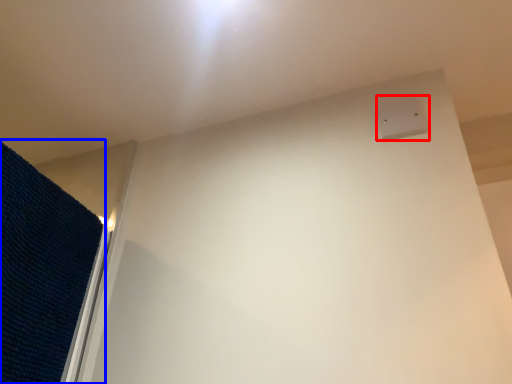
Question: Which object appears closest to the camera in this image, electric outlet (highlighted by a red box) or mat (highlighted by a blue box)?

Choices:
 (A) electric outlet
 (B) mat

Answer: (B)